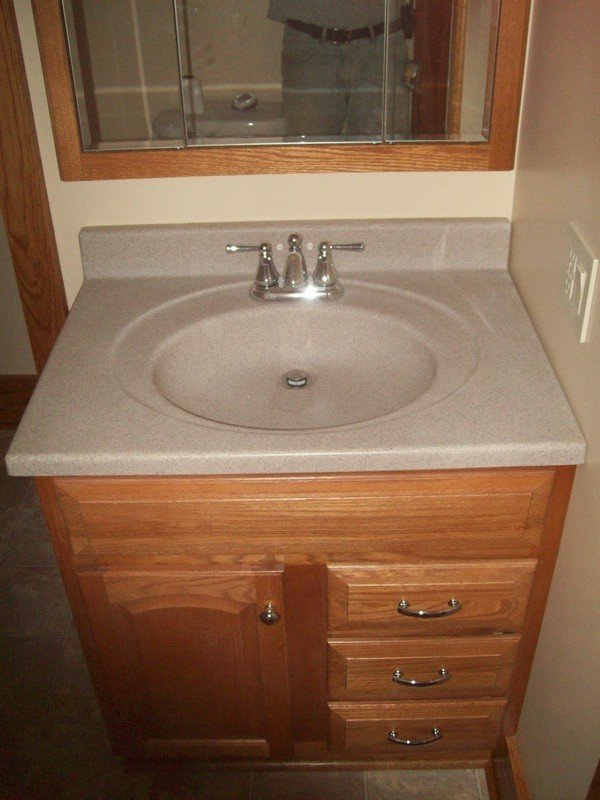
You are a GUI agent. You are given a task and a screenshot of the screen. Output one action in this format:
    pyautogui.click(x=<x>, y=<y>)
    Task: Click on the reflection in the mirror
    Image resolution: width=600 pixels, height=800 pixels.
    Given the screenshot: What is the action you would take?
    tap(327, 106), tap(334, 14)